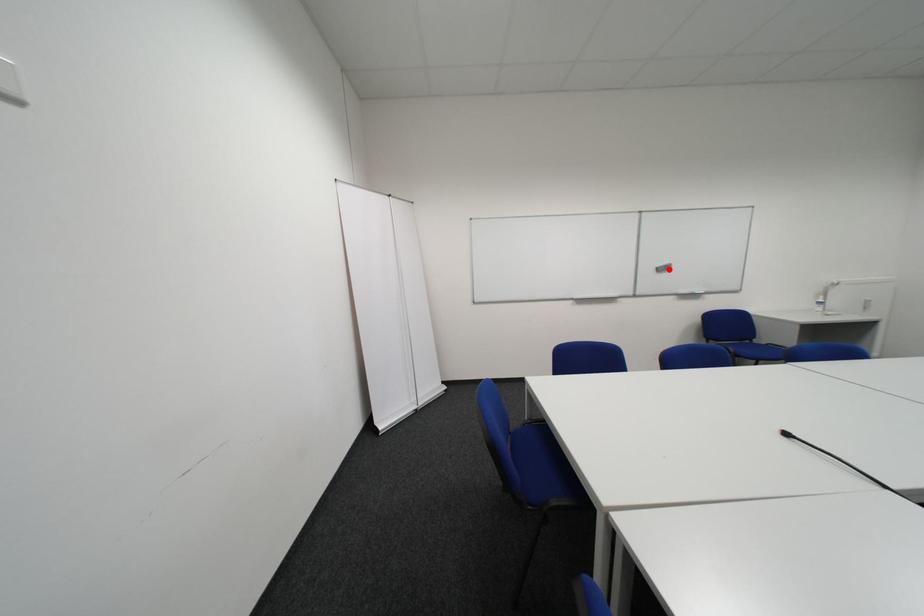
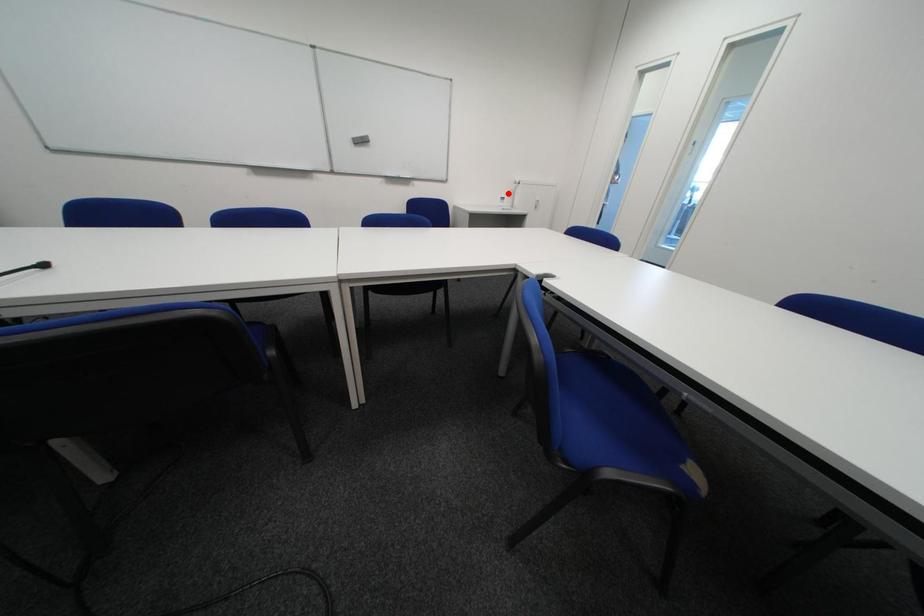
I am providing you with two images of the same scene from different viewpoints. A red point is marked on the first image and another point is marked on the second image. Is the marked point in image1 the same physical position as the marked point in image2?

No